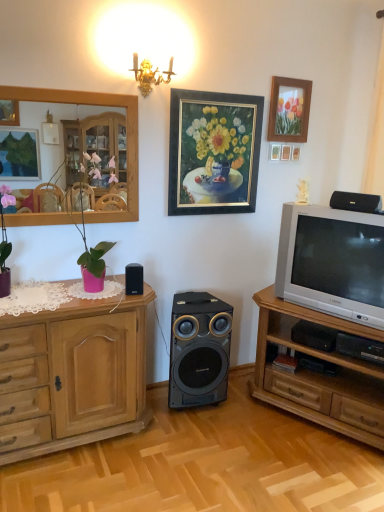
Find the location of a particular element. vacant area that is situated to the right of wooden cabinet at left is located at coordinates (185, 449).